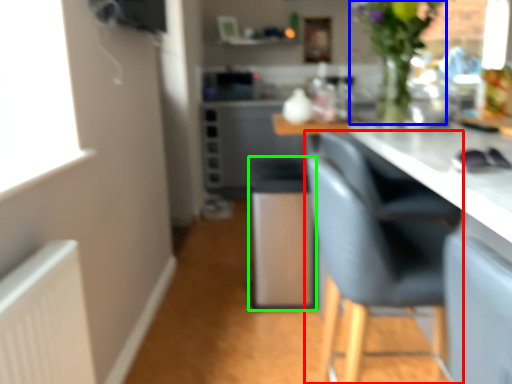
Question: Estimate the real-world distances between objects in this image. Which object is farther from chair (highlighted by a red box), floral arrangement (highlighted by a blue box) or bar stool (highlighted by a green box)?

Choices:
 (A) floral arrangement
 (B) bar stool

Answer: (B)